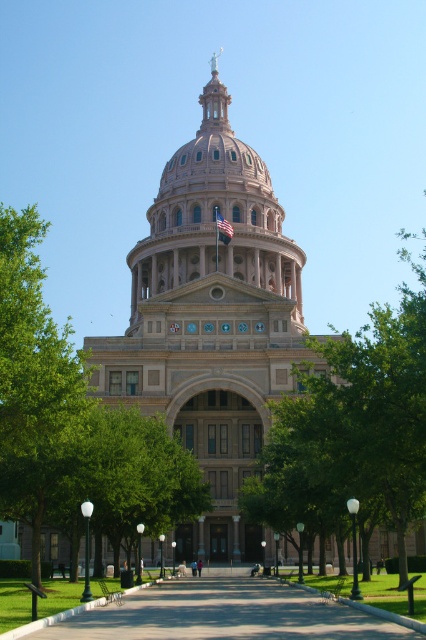
Question: Is beige stone dome at center positioned at the back of paved concrete path at center?

Choices:
 (A) yes
 (B) no

Answer: (A)

Question: Among these objects, which one is farthest from the camera?

Choices:
 (A) beige stone dome at center
 (B) paved concrete path at center

Answer: (A)

Question: Among these objects, which one is nearest to the camera?

Choices:
 (A) green leafy tree at center
 (B) paved concrete path at center
 (C) beige stone dome at center

Answer: (B)

Question: Which point appears farthest from the camera in this image?

Choices:
 (A) (420, 348)
 (B) (206, 216)
 (C) (213, 588)

Answer: (B)

Question: Is beige stone dome at center thinner than paved concrete path at center?

Choices:
 (A) no
 (B) yes

Answer: (A)

Question: Can you confirm if green leafy tree at center is positioned below beige stone dome at center?

Choices:
 (A) no
 (B) yes

Answer: (B)